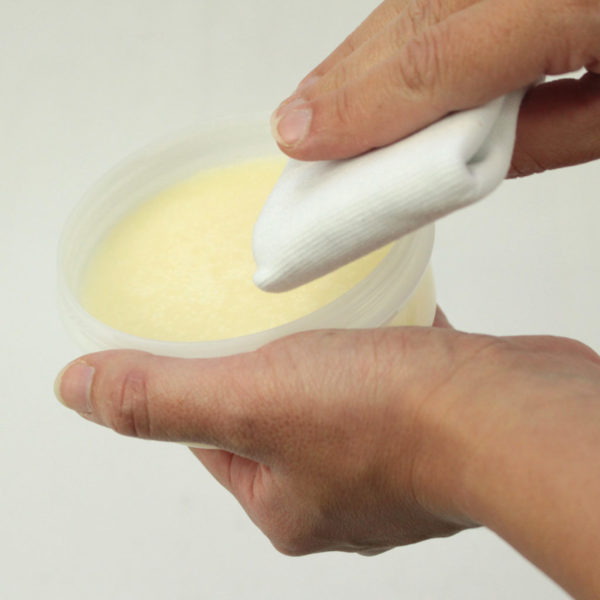
At what (x,y) coordinates should I click in order to perform the action: click on microfiber cloth. Please return your answer as a coordinate pair (x, y). The height and width of the screenshot is (600, 600). Looking at the image, I should click on (353, 197).